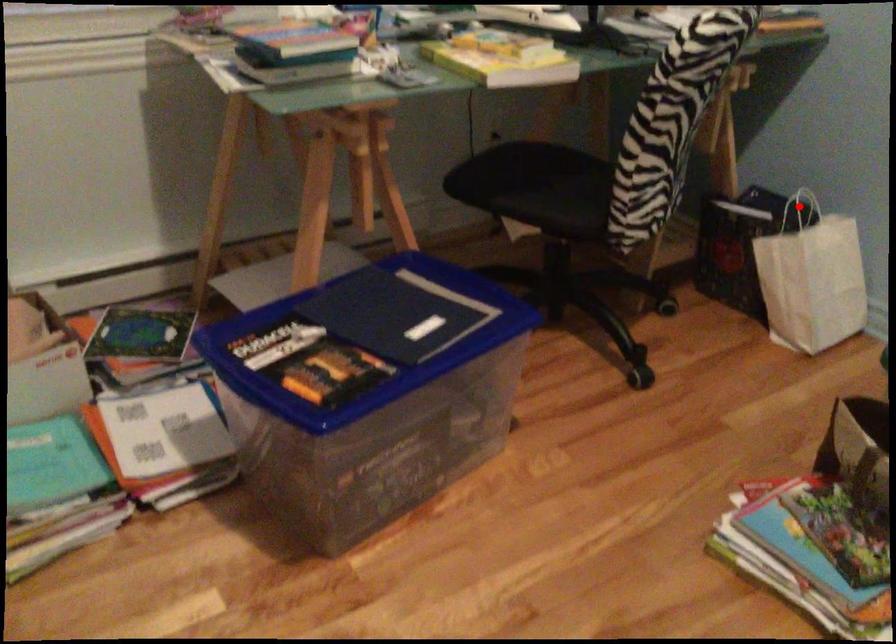
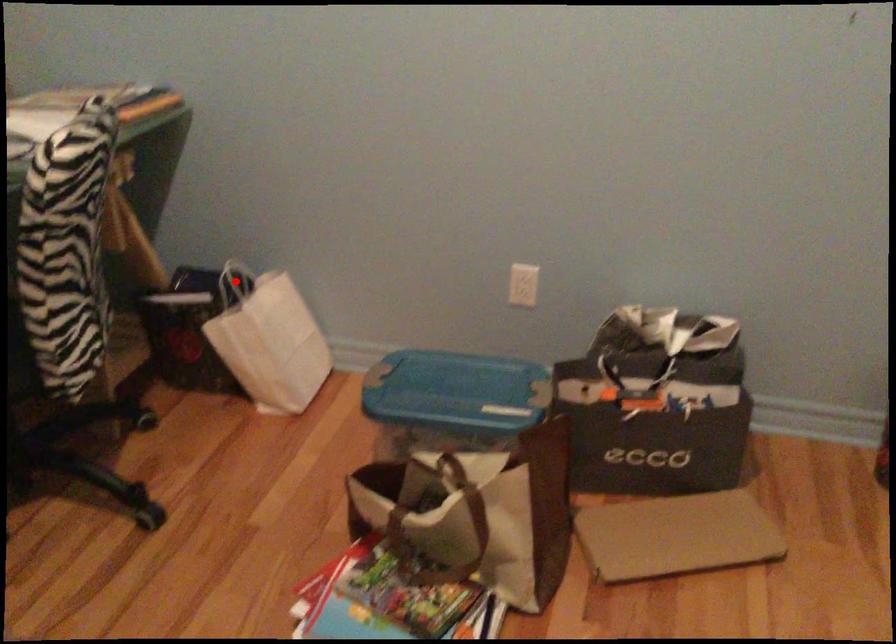
I am providing you with two images of the same scene from different viewpoints. A red point is marked on the first image and another point is marked on the second image. Are the points marked in image1 and image2 representing the same 3D position?

Yes